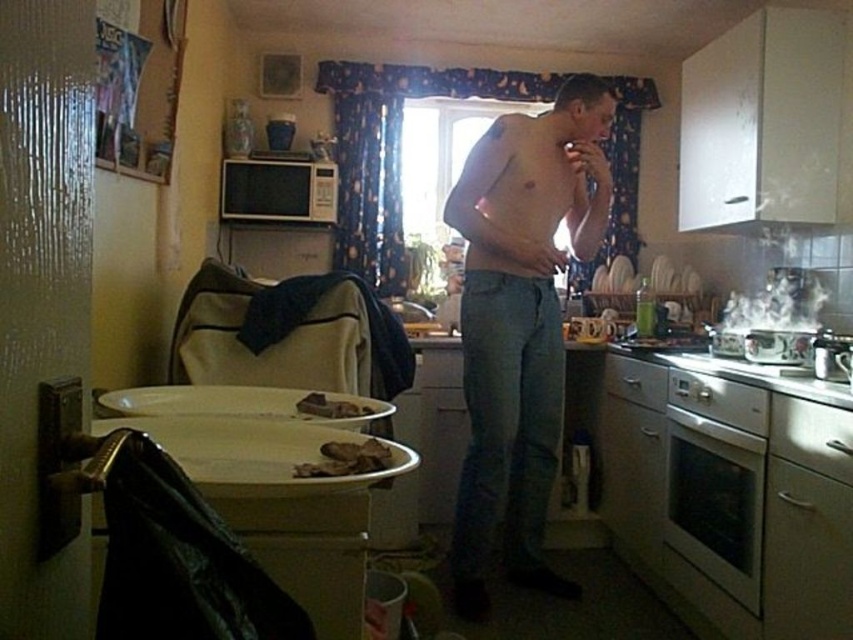
You are a delivery robot that is 1.8 meters tall. You need to deliver a package to the brown crumbly bread at center. However, there is a white glossy exhaust hood at upper right above your path. Will the robot be able to pass under the exhaust hood without hitting it?

The distance between the white glossy exhaust hood at upper right and brown crumbly bread at center is 1.98 meters. Since the robot is 1.8 meters tall, it can pass under the exhaust hood as the clearance is sufficient.

You are a chef preparing to cook in the kitchen. You see the white glossy exhaust hood at upper right and the brown crumbly bread at center. Which object is positioned higher in the image?

The white glossy exhaust hood at upper right is located above the brown crumbly bread at center, so it is positioned higher in the image.